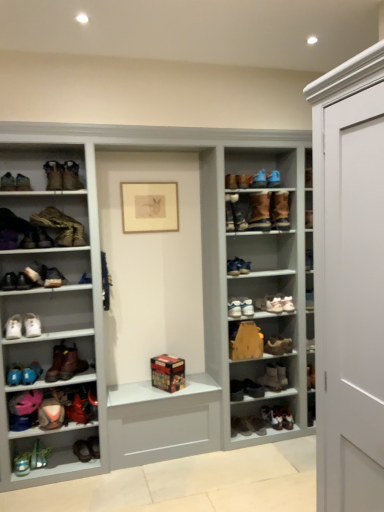
The width and height of the screenshot is (384, 512). I want to click on free spot in front of shiny black sneakers at lower center, which ranks as the 4th footwear in bottom-to-top order, so click(286, 438).